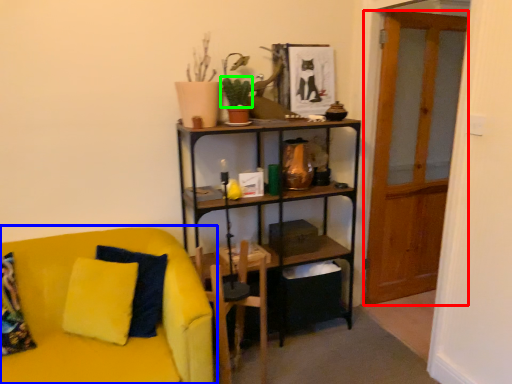
Question: Estimate the real-world distances between objects in this image. Which object is closer to glass door (highlighted by a red box), studio couch (highlighted by a blue box) or plant (highlighted by a green box)?

Choices:
 (A) studio couch
 (B) plant

Answer: (B)